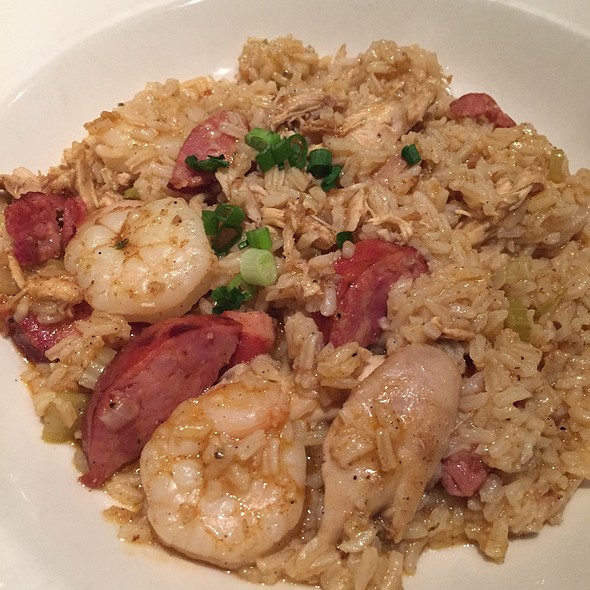
This screenshot has height=590, width=590. Identify the location of plate. [x=504, y=74].